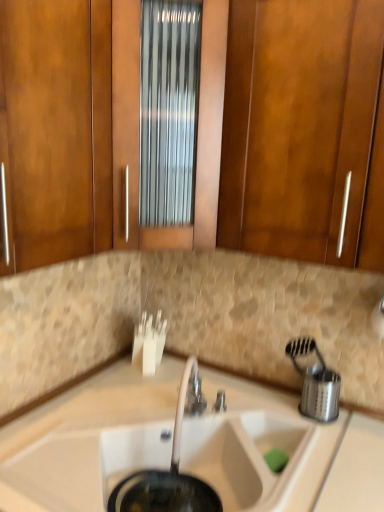
Locate an element on the screen. vacant space to the left of silver metallic faucet at center is located at coordinates (183, 413).